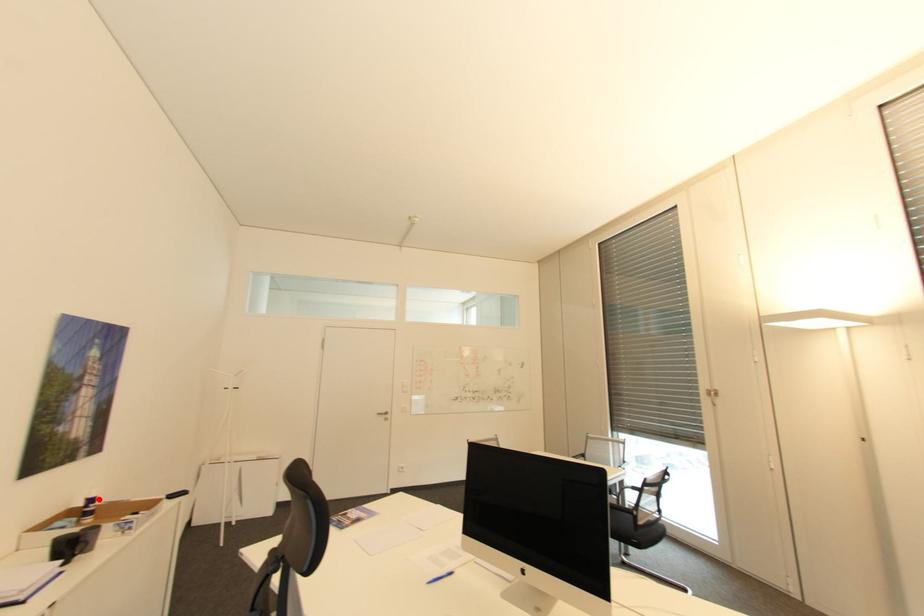
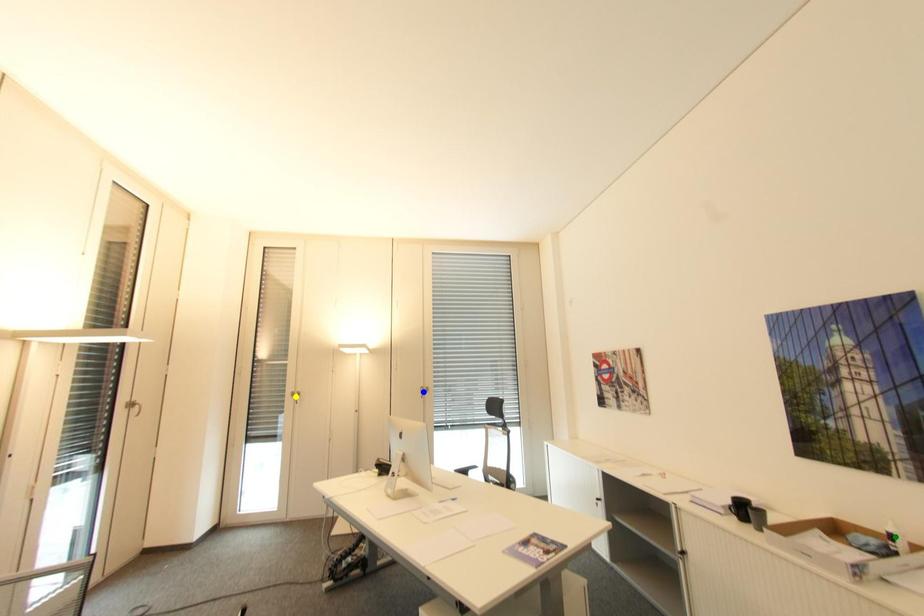
Question: I am providing you with two images of the same scene from different viewpoints. A red point is marked on the first image. You are given multiple points on the second image. Which point in image 2 represents the same 3d spot as the red point in image 1?

Choices:
 (A) green point
 (B) yellow point
 (C) blue point

Answer: (A)